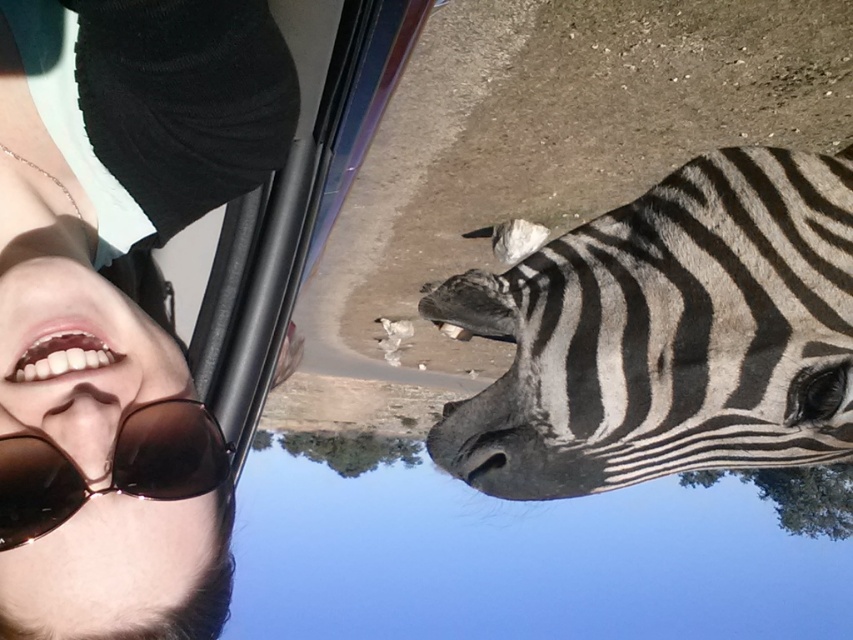
You are a photographer trying to capture both the black and white striped zebra at center and the matte brown nose at lower left in the same frame. Based on their positions, which object should you focus on first to ensure both are in focus?

You should focus on the black and white striped zebra at center first because it is closer to you than the matte brown nose at lower left. By focusing on the closer object, both will be in focus due to the depth of field.

You are a photographer trying to capture a closeup of the black and white striped zebra at center and the brown matte goggles at lower left. Since the zebra is larger, which object should you zoom in on first to ensure both are in focus?

The black and white striped zebra at center is bigger than the brown matte goggles at lower left, so you should zoom in on the black and white striped zebra at center first to ensure both are in focus.